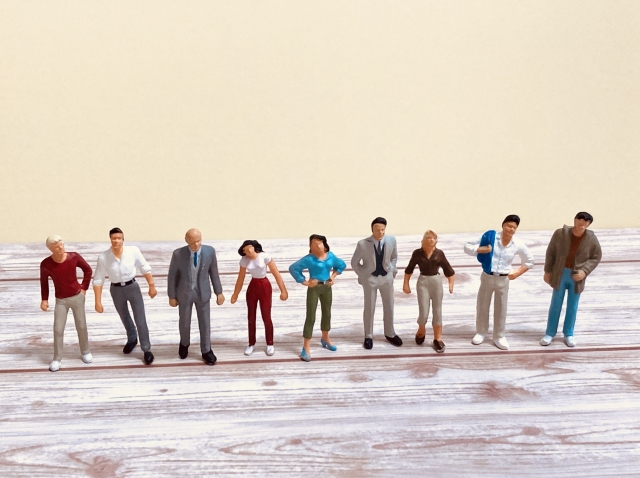
Locate an element on the screen. The width and height of the screenshot is (640, 478). action figure is located at coordinates (64, 274), (120, 280), (193, 271), (256, 284), (307, 295), (378, 271), (426, 289), (484, 300), (570, 281).